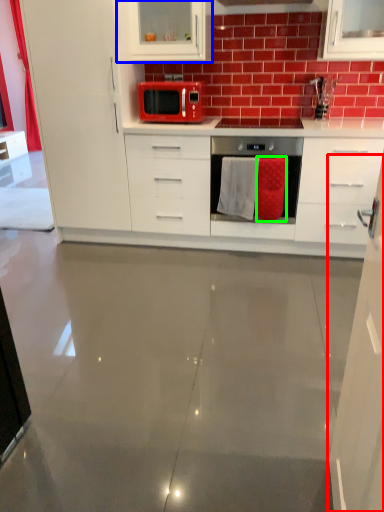
Question: Considering the real-world distances, which object is closest to cabinetry (highlighted by a red box)? cabinetry (highlighted by a blue box) or cloth (highlighted by a green box).

Choices:
 (A) cabinetry
 (B) cloth

Answer: (B)